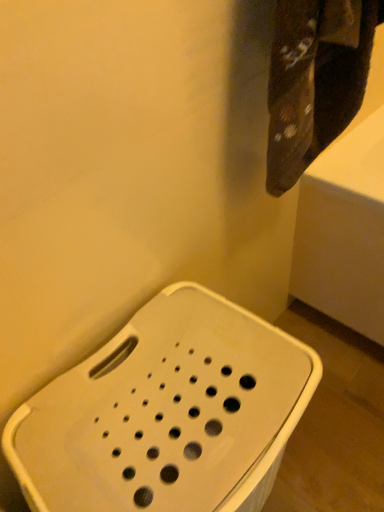
Question: From the image's perspective, is dark brown fabric at upper right above or below white plastic stool at lower left?

Choices:
 (A) below
 (B) above

Answer: (B)

Question: Considering the positions of dark brown fabric at upper right and white plastic stool at lower left in the image, is dark brown fabric at upper right bigger or smaller than white plastic stool at lower left?

Choices:
 (A) big
 (B) small

Answer: (B)

Question: Do you think dark brown fabric at upper right is within white plastic stool at lower left, or outside of it?

Choices:
 (A) outside
 (B) inside

Answer: (A)

Question: Considering their positions, is white plastic stool at lower left located in front of or behind dark brown fabric at upper right?

Choices:
 (A) behind
 (B) front

Answer: (B)

Question: Would you say white plastic stool at lower left is to the left or to the right of dark brown fabric at upper right in the picture?

Choices:
 (A) right
 (B) left

Answer: (B)

Question: Considering the positions of white plastic stool at lower left and dark brown fabric at upper right in the image, is white plastic stool at lower left wider or thinner than dark brown fabric at upper right?

Choices:
 (A) thin
 (B) wide

Answer: (B)

Question: Is white plastic stool at lower left spatially inside dark brown fabric at upper right, or outside of it?

Choices:
 (A) inside
 (B) outside

Answer: (B)